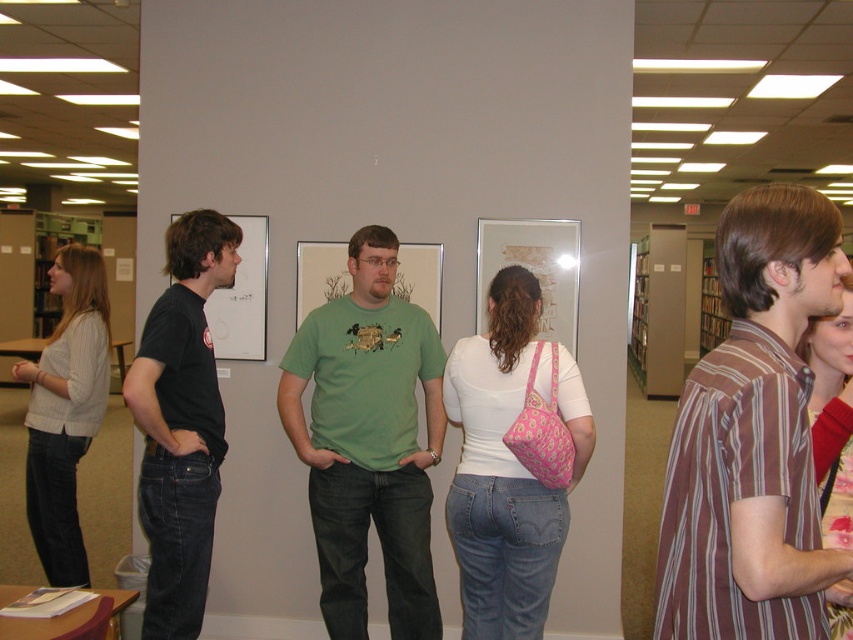
You are standing in the library and see a point marked at coordinates (753, 438). According to the image, which object is this point located on?

The point at coordinates (753, 438) is located on the brown striped shirt at right.